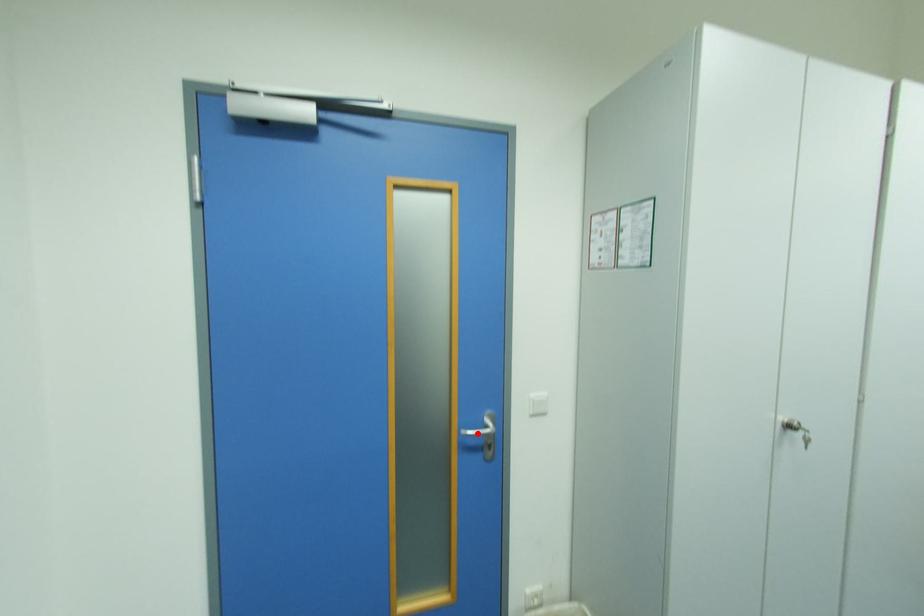
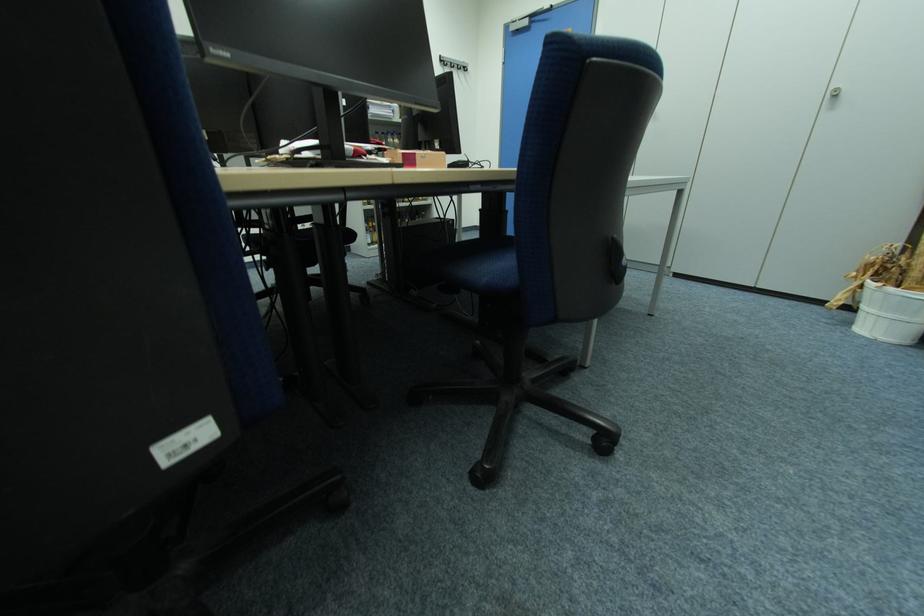
Question: I am providing you with two images of the same scene from different viewpoints. A red point is marked on the first image. Is the red point's position out of view in image 2?

Choices:
 (A) Yes
 (B) No

Answer: (A)